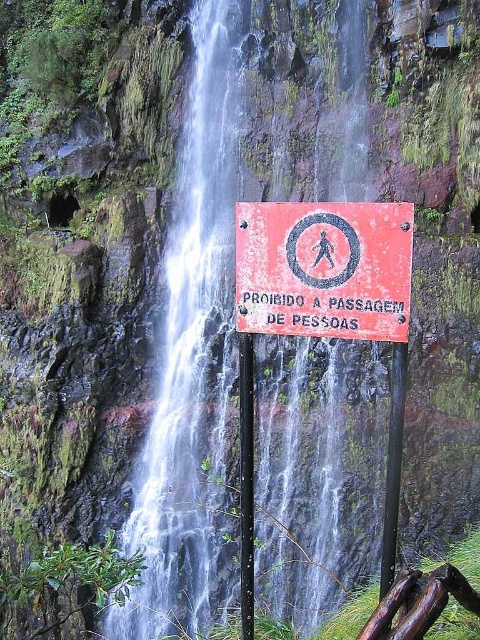
Can you confirm if rusty metal sign at center is thinner than black plastic pole at center?

No.

Is point (312, 314) closer to viewer compared to point (249, 444)?

Yes, point (312, 314) is closer to viewer.

The width and height of the screenshot is (480, 640). What do you see at coordinates (324, 268) in the screenshot?
I see `rusty metal sign at center` at bounding box center [324, 268].

Locate an element on the screen. rusty metal sign at center is located at coordinates (324, 268).

Is point (248, 387) less distant than point (391, 381)?

Yes, it is in front of point (391, 381).

Who is lower down, black plastic pole at center or black metal pole at center?

black metal pole at center is lower down.

This screenshot has width=480, height=640. I want to click on black plastic pole at center, so click(245, 483).

Does smooth rock waterfall at center have a larger size compared to black plastic pole at center?

Correct, smooth rock waterfall at center is larger in size than black plastic pole at center.

Is smooth rock waterfall at center further to camera compared to black plastic pole at center?

Yes, it is behind black plastic pole at center.

Is point (360, 125) positioned in front of point (242, 500)?

No.

Where is `smooth rock waterfall at center`? The width and height of the screenshot is (480, 640). smooth rock waterfall at center is located at coordinates (194, 348).